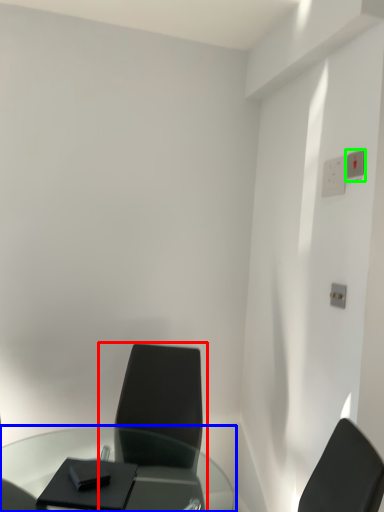
Question: Which is farther away from chair (highlighted by a red box)? table (highlighted by a blue box) or electric outlet (highlighted by a green box)?

Choices:
 (A) table
 (B) electric outlet

Answer: (B)